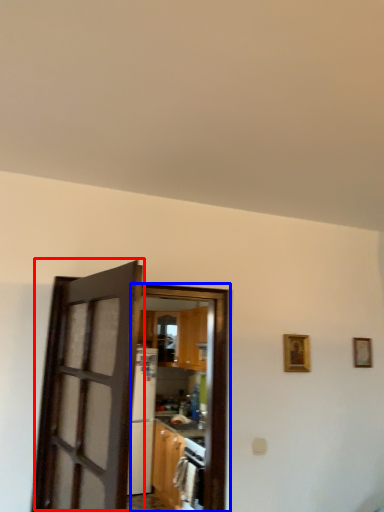
Question: Which point is further to the camera, door (highlighted by a red box) or door (highlighted by a blue box)?

Choices:
 (A) door
 (B) door

Answer: (B)